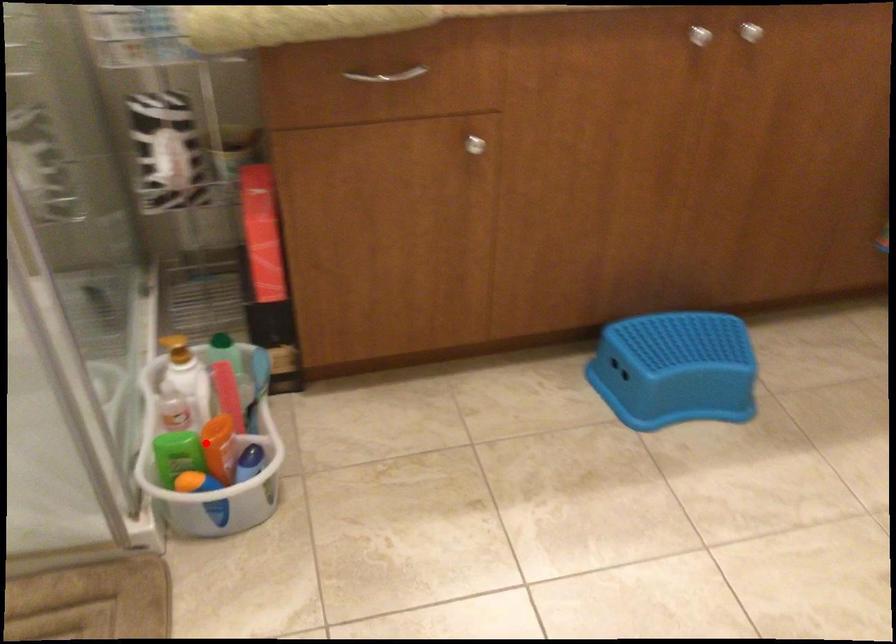
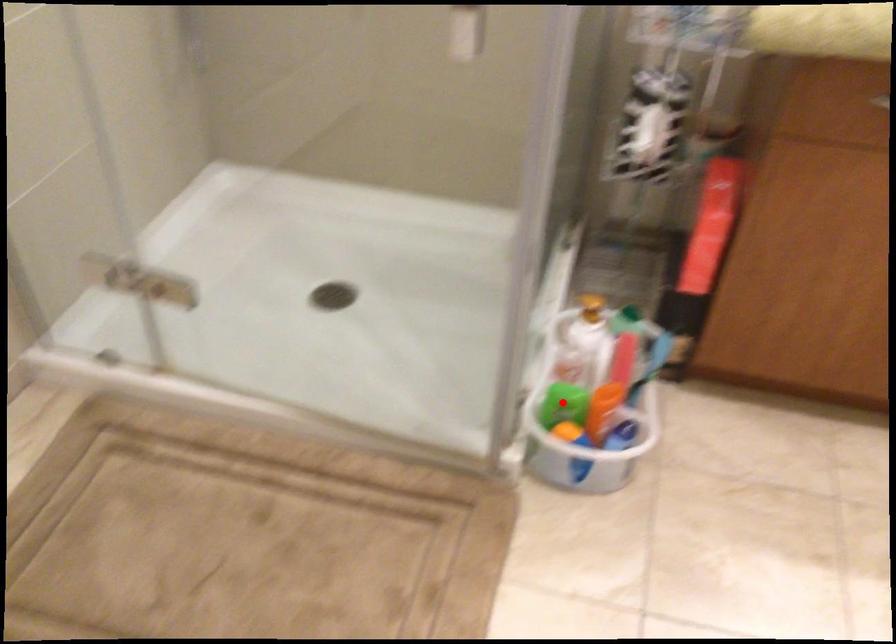
Based on the photo, I am providing you with two images of the same scene from different viewpoints. A red point is marked on the first image and another point is marked on the second image. Are the points marked in image1 and image2 representing the same 3D position?

No